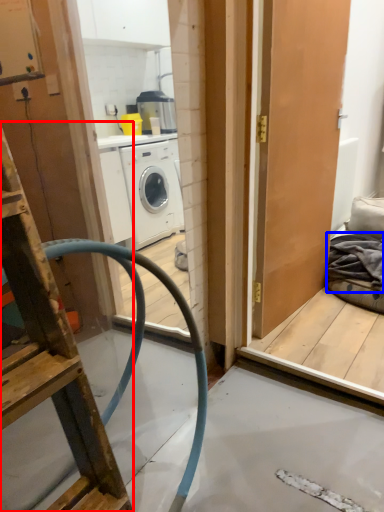
Question: Among these objects, which one is farthest to the camera, ladder (highlighted by a red box) or material (highlighted by a blue box)?

Choices:
 (A) ladder
 (B) material

Answer: (B)